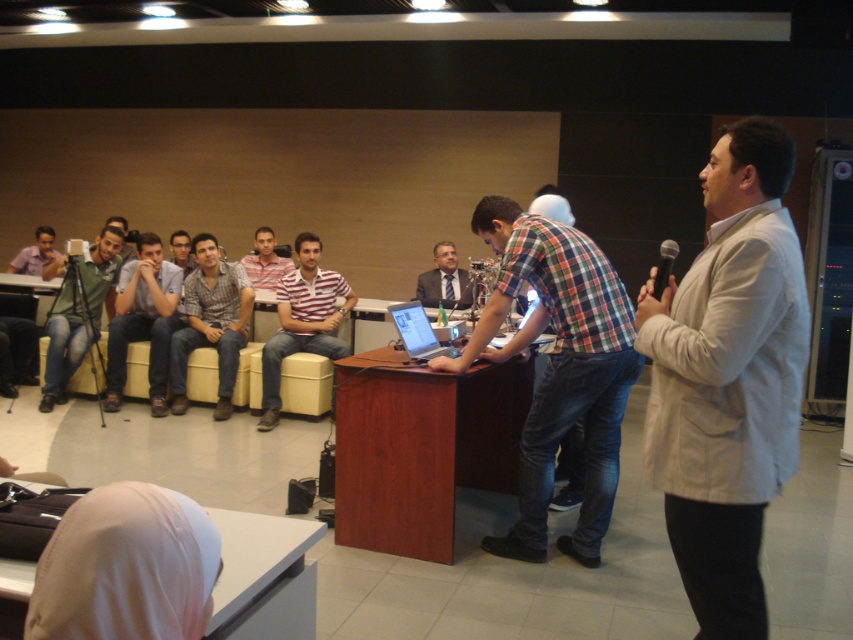
Consider the image. Who is lower down, plaid shirt at center or matte black suit at center?

Positioned lower is plaid shirt at center.

Is point (196, 314) closer to camera compared to point (432, 280)?

Yes.

Where is `plaid shirt at center`? Image resolution: width=853 pixels, height=640 pixels. plaid shirt at center is located at coordinates (212, 323).

Is matte green shirt at left in front of black plastic microphone at upper right?

Yes, matte green shirt at left is in front of black plastic microphone at upper right.

Looking at this image, who is more distant from viewer, [91,328] or [653,289]?

The point [91,328] is more distant.

The width and height of the screenshot is (853, 640). Identify the location of matte green shirt at left. (79, 314).

What do you see at coordinates (143, 321) in the screenshot? The width and height of the screenshot is (853, 640). I see `light blue shirt at center` at bounding box center [143, 321].

The image size is (853, 640). Identify the location of light blue shirt at center. (143, 321).